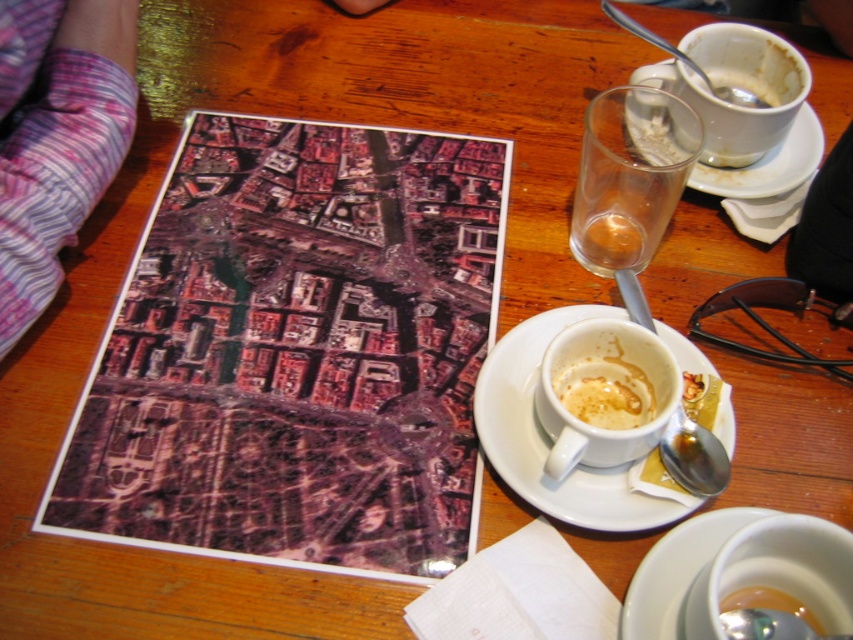
Question: Can you confirm if white ceramic saucer at lower right is bigger than matte white cup at center?

Choices:
 (A) yes
 (B) no

Answer: (A)

Question: Is translucent glass at upper center closer to the viewer compared to white matte cup at upper right?

Choices:
 (A) no
 (B) yes

Answer: (B)

Question: Which object appears farthest from the camera in this image?

Choices:
 (A) white matte cup at upper right
 (B) matte ceramic cup at lower center

Answer: (A)

Question: Is the position of matte white cup at center less distant than that of white ceramic saucer at upper right?

Choices:
 (A) no
 (B) yes

Answer: (B)

Question: Which point is farther to the camera?

Choices:
 (A) white ceramic saucer at lower right
 (B) translucent glass at upper center
 (C) purple striped socks at lower left

Answer: (B)

Question: Which object appears farthest from the camera in this image?

Choices:
 (A) white ceramic saucer at lower right
 (B) white ceramic saucer at center
 (C) purple striped socks at lower left
 (D) matte white cup at center

Answer: (D)